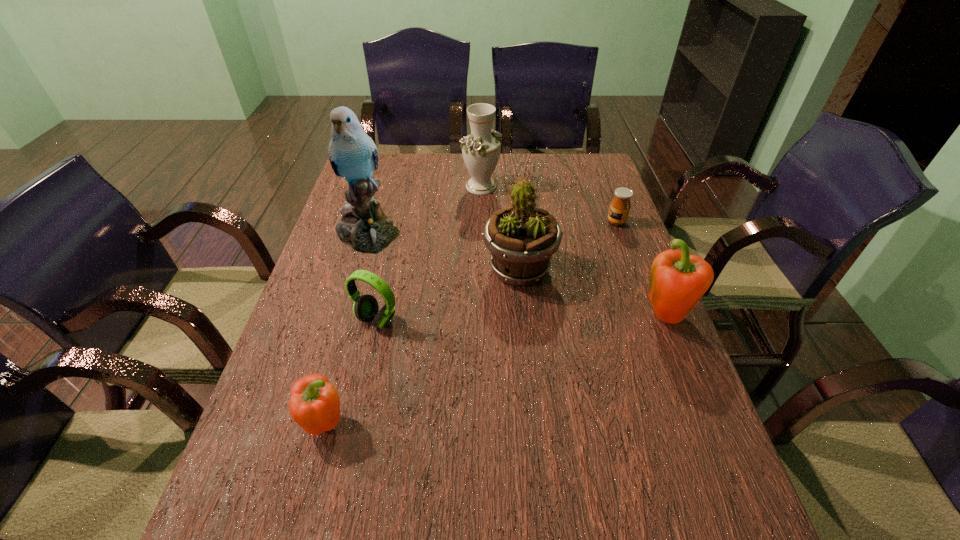
This screenshot has width=960, height=540. Find the location of `the shorter pepper`. the shorter pepper is located at coordinates pos(315,404).

Locate an element on the screen. This screenshot has height=540, width=960. the nearest object is located at coordinates (315, 404).

Identify the location of the right pepper. The image size is (960, 540). (678, 280).

This screenshot has height=540, width=960. In order to click on the taller pepper in this screenshot , I will do `click(678, 280)`.

Locate an element on the screen. Image resolution: width=960 pixels, height=540 pixels. the farthest object is located at coordinates (481, 150).

Image resolution: width=960 pixels, height=540 pixels. In order to click on flowerpot in this screenshot , I will do `click(522, 238)`.

Find the location of a particular element. The image size is (960, 540). honey is located at coordinates (620, 206).

The width and height of the screenshot is (960, 540). Find the location of `the tallest object`. the tallest object is located at coordinates (364, 227).

This screenshot has width=960, height=540. I want to click on headset, so click(x=365, y=308).

Find the location of a particular element. The width and height of the screenshot is (960, 540). vacant space located on the front of the shorter pepper is located at coordinates (309, 488).